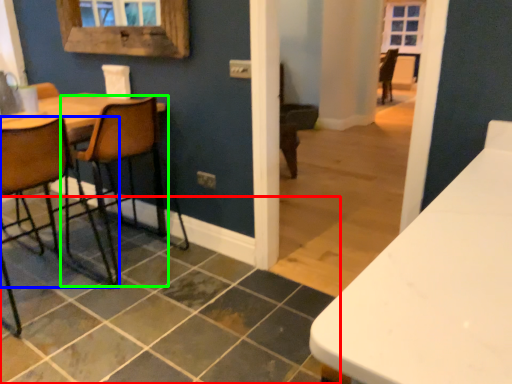
Question: Considering the real-world distances, which object is farthest from tile (highlighted by a red box)? chair (highlighted by a blue box) or chair (highlighted by a green box)?

Choices:
 (A) chair
 (B) chair

Answer: (B)